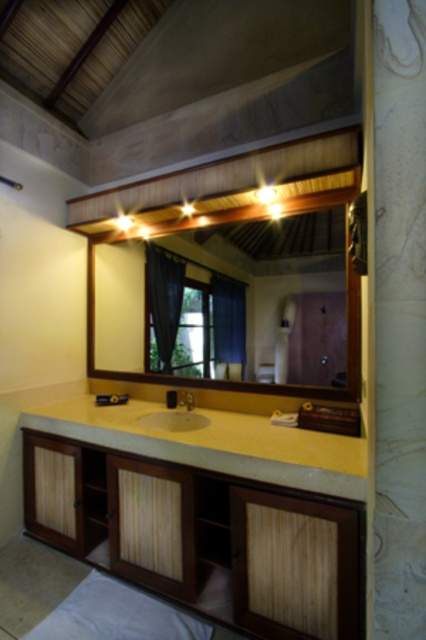
Question: From the image, what is the correct spatial relationship of wooden frame mirror at upper center in relation to dark blue fabric curtain at center?

Choices:
 (A) below
 (B) above

Answer: (B)

Question: Which point is closer to the camera?

Choices:
 (A) (356, 332)
 (B) (186, 404)
 (C) (176, 266)
 (D) (181, 416)

Answer: (A)

Question: Observing the image, what is the correct spatial positioning of wooden frame mirror at upper center in reference to dark blue fabric curtain at center?

Choices:
 (A) left
 (B) right

Answer: (A)

Question: Is wooden cabinet at lower center wider than black fabric curtain at center?

Choices:
 (A) yes
 (B) no

Answer: (A)

Question: Among these objects, which one is nearest to the camera?

Choices:
 (A) wooden frame mirror at upper center
 (B) yellow laminate sink at center

Answer: (B)

Question: Which point is closer to the camera taking this photo?

Choices:
 (A) (166, 264)
 (B) (224, 285)
 (C) (183, 419)
 (D) (227, 472)

Answer: (D)